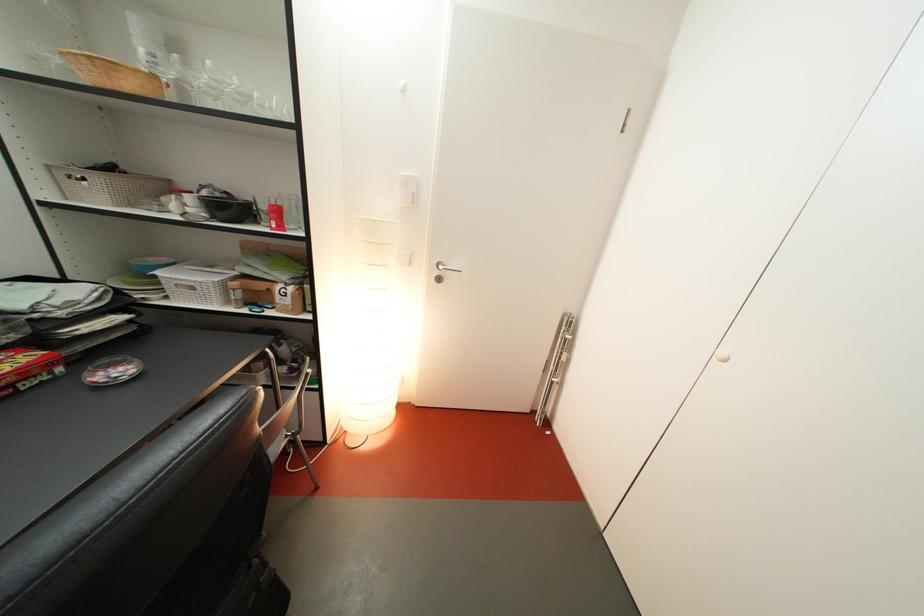
The image size is (924, 616). Identify the location of small glass dish. (112, 370).